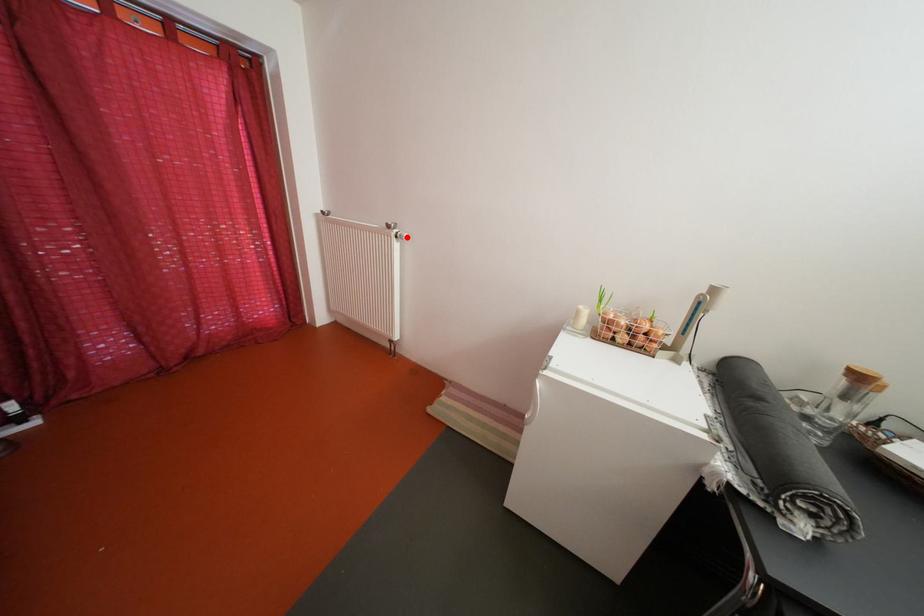
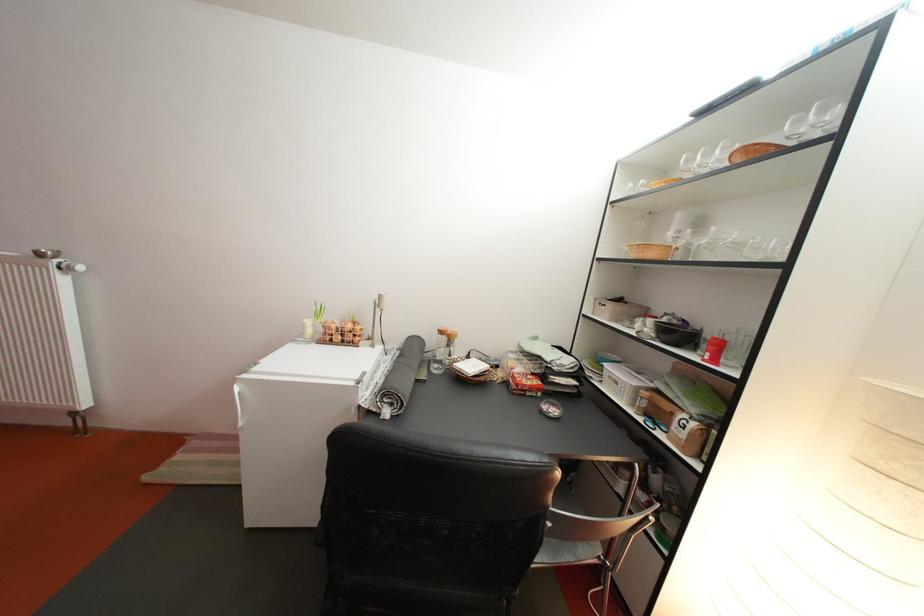
The point at the highlighted location is marked in the first image. Where is the corresponding point in the second image?

(68, 267)